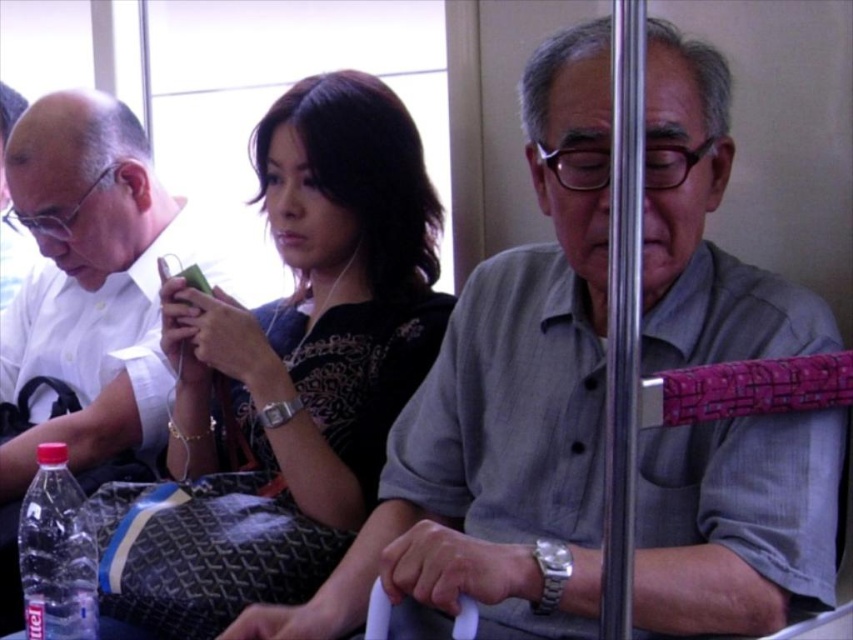
Does gray cotton shirt at center lie in front of matte black shirt at center?

That is True.

Is gray cotton shirt at center positioned at the back of matte black shirt at center?

No, it is in front of matte black shirt at center.

Where is `gray cotton shirt at center`? The width and height of the screenshot is (853, 640). gray cotton shirt at center is located at coordinates (502, 410).